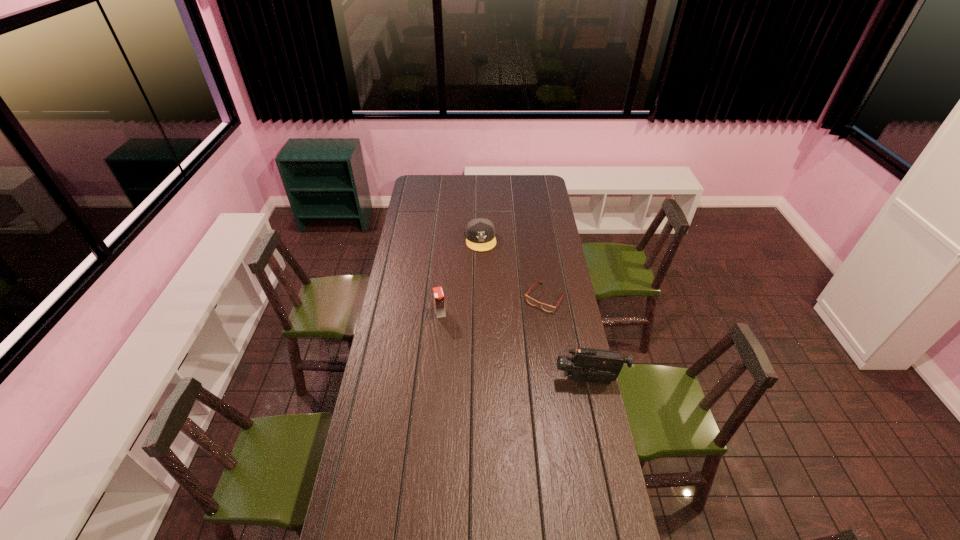
Find the location of a particular element. This screenshot has height=540, width=960. free spot located on the front-facing side of the tallest object is located at coordinates (490, 380).

At what (x,y) coordinates should I click in order to perform the action: click on vacant region located on the front-facing side of the third object from right to left. Please return your answer as a coordinate pair (x, y). Looking at the image, I should click on coord(486,278).

Where is `vacant area situated on the front-facing side of the third object from right to left`? This screenshot has width=960, height=540. vacant area situated on the front-facing side of the third object from right to left is located at coordinates (486, 279).

Find the location of a particular element. The height and width of the screenshot is (540, 960). free space located on the front-facing side of the third object from right to left is located at coordinates (485, 272).

This screenshot has width=960, height=540. In order to click on free point located 0.120m on the front-facing side of the spectacles in this screenshot , I will do `click(523, 329)`.

At what (x,y) coordinates should I click in order to perform the action: click on vacant space located 0.260m on the front-facing side of the spectacles. Please return your answer as a coordinate pair (x, y). This screenshot has width=960, height=540. Looking at the image, I should click on (509, 349).

Image resolution: width=960 pixels, height=540 pixels. I want to click on vacant space located 0.050m on the front-facing side of the spectacles, so click(x=530, y=319).

Locate an element on the screen. This screenshot has height=540, width=960. camcorder situated at the right edge is located at coordinates (586, 365).

The height and width of the screenshot is (540, 960). I want to click on spectacles that is at the right edge, so click(x=548, y=308).

Locate an element on the screen. This screenshot has height=540, width=960. vacant space at the far edge is located at coordinates (487, 194).